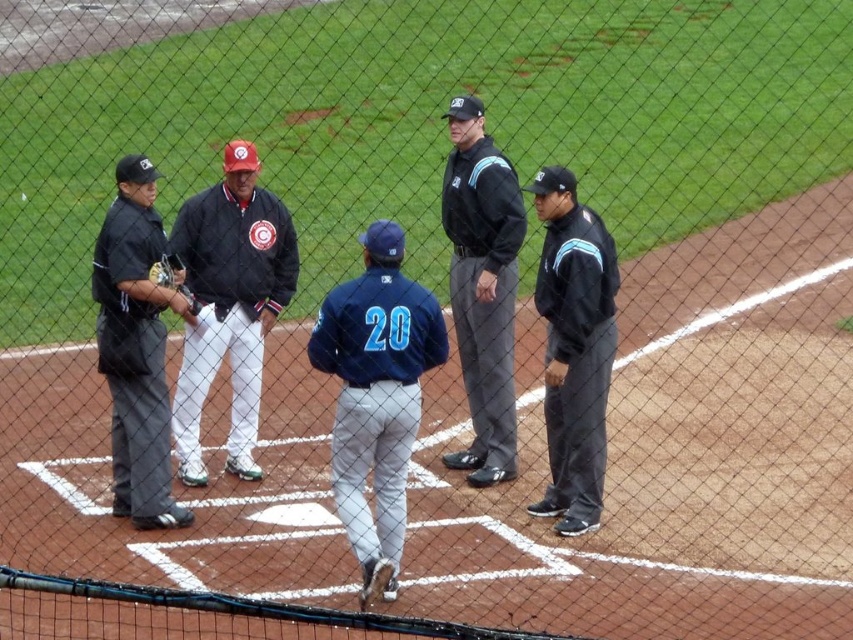
Does black leather jacket at center appear over black uniformed man at left?

Indeed, black leather jacket at center is positioned over black uniformed man at left.

Is point (252, 390) more distant than point (137, 186)?

Yes, point (252, 390) is behind point (137, 186).

In order to click on black leather jacket at center in this screenshot , I will do `click(230, 304)`.

At what (x,y) coordinates should I click in order to perform the action: click on black leather jacket at center. Please return your answer as a coordinate pair (x, y). The height and width of the screenshot is (640, 853). Looking at the image, I should click on (230, 304).

Is dark blue jersey at center closer to the viewer compared to dark brown leather glove at left?

No, dark blue jersey at center is further to the viewer.

Measure the distance between dark blue jersey at center and camera.

dark blue jersey at center and camera are 32.13 feet apart.

Describe the element at coordinates (376, 396) in the screenshot. The image size is (853, 640). I see `dark blue jersey at center` at that location.

Locate an element on the screen. This screenshot has height=640, width=853. dark blue jersey at center is located at coordinates (376, 396).

Is matte black jacket at center to the left of dark brown leather glove at left from the viewer's perspective?

Incorrect, matte black jacket at center is not on the left side of dark brown leather glove at left.

Is point (554, 250) farther from camera compared to point (199, 308)?

No, it is not.

At what (x,y) coordinates should I click in order to perform the action: click on matte black jacket at center. Please return your answer as a coordinate pair (x, y). The width and height of the screenshot is (853, 640). Looking at the image, I should click on (573, 348).

The image size is (853, 640). Identify the location of matte black jacket at center. (573, 348).